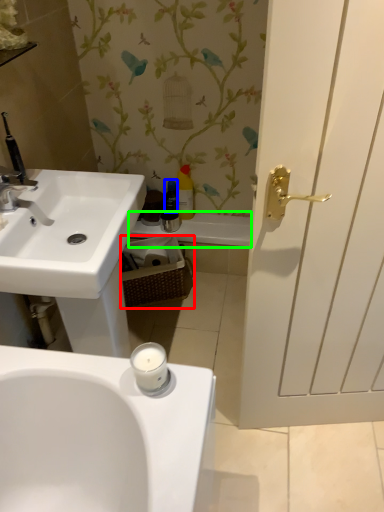
Question: Which is nearer to the basket (highlighted by a red box)? toiletry (highlighted by a blue box) or bath (highlighted by a green box).

Choices:
 (A) toiletry
 (B) bath

Answer: (B)